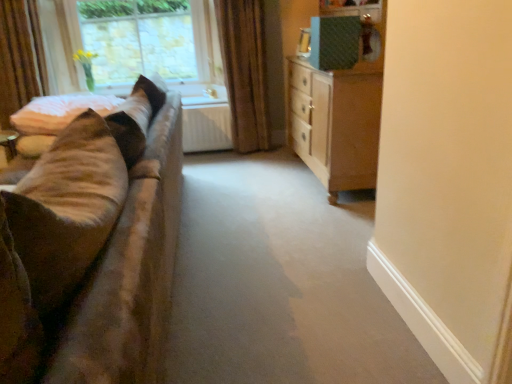
Question: From the image's perspective, is clear glass window at upper left above or below brown fabric curtain at upper center?

Choices:
 (A) below
 (B) above

Answer: (B)

Question: From a real-world perspective, is clear glass window at upper left positioned above or below brown fabric curtain at upper center?

Choices:
 (A) above
 (B) below

Answer: (A)

Question: Estimate the real-world distances between objects in this image. Which object is closer to the soft beige fabric at left?

Choices:
 (A) wooden chest of drawers at right
 (B) velvet brown couch at left
 (C) brown fabric curtain at upper center
 (D) clear glass window at upper left

Answer: (C)

Question: Estimate the real-world distances between objects in this image. Which object is closer to the brown fabric curtain at upper center?

Choices:
 (A) clear glass window at upper left
 (B) velvet brown couch at left
 (C) wooden chest of drawers at right
 (D) soft beige fabric at left

Answer: (A)